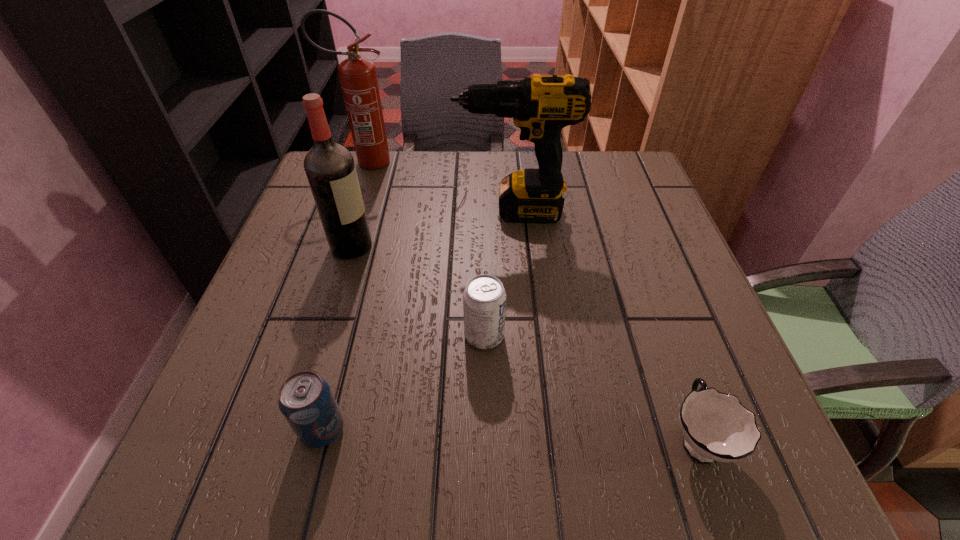
You are a GUI agent. You are given a task and a screenshot of the screen. Output one action in this format:
    pyautogui.click(x=<x>, y=<y>)
    Task: Click on the unoccupied position between the second farthest object and the farther pop soda
    The image size is (960, 540).
    Given the screenshot: What is the action you would take?
    pyautogui.click(x=498, y=273)

Where is `vacant area between the liquor and the second farthest object`? The width and height of the screenshot is (960, 540). vacant area between the liquor and the second farthest object is located at coordinates (432, 228).

The image size is (960, 540). Find the location of `vacant area that lies between the third farthest object and the drill`. vacant area that lies between the third farthest object and the drill is located at coordinates (432, 228).

Identify the location of free space between the second farthest object and the nearer pop soda. (418, 320).

This screenshot has width=960, height=540. What are the coordinates of `free area in between the fifth nearest object and the right pop soda` in the screenshot? It's located at (498, 273).

This screenshot has width=960, height=540. I want to click on free space between the cup and the nearer pop soda, so click(510, 434).

You are a GUI agent. You are given a task and a screenshot of the screen. Output one action in this format:
    pyautogui.click(x=<x>, y=<y>)
    Task: Click on the object that is the closest to the drill
    The height and width of the screenshot is (540, 960).
    Given the screenshot: What is the action you would take?
    point(330,168)

Identify which object is the second closest to the liquor. Please provide its 2D coordinates. Your answer should be formatted as a tuple, i.e. [(x, y)], where the tuple contains the x and y coordinates of a point satisfying the conditions above.

[(358, 77)]

The width and height of the screenshot is (960, 540). I want to click on vacant space that satisfies the following two spatial constraints: 1. on the front-facing side of the liquor; 2. on the side of the cup with the handle, so click(x=294, y=438).

At what (x,y) coordinates should I click in order to perform the action: click on vacant region that satisfies the following two spatial constraints: 1. from the nozzle of the fire extinguisher; 2. on the side of the rightmost object with the handle. Please return your answer as a coordinate pair (x, y). The width and height of the screenshot is (960, 540). Looking at the image, I should click on (275, 438).